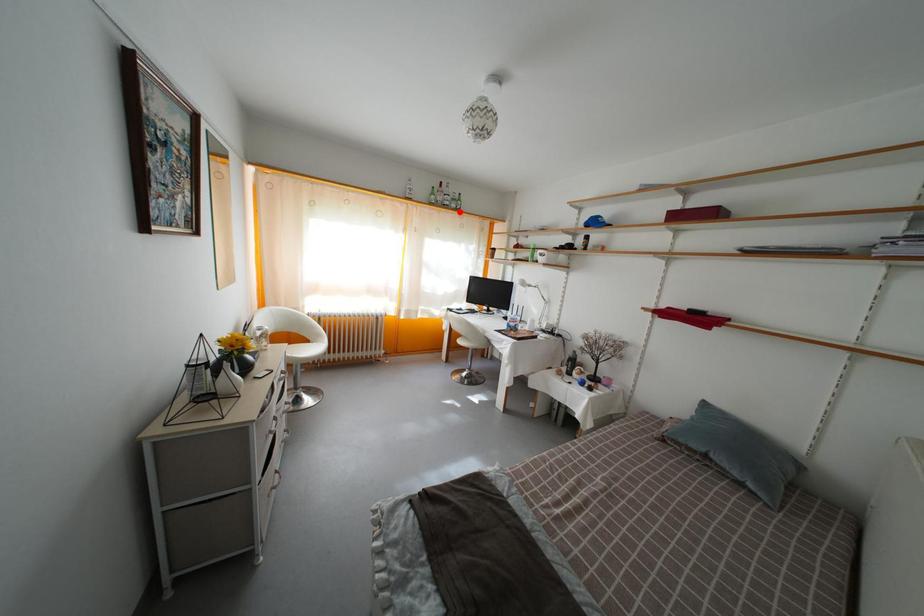
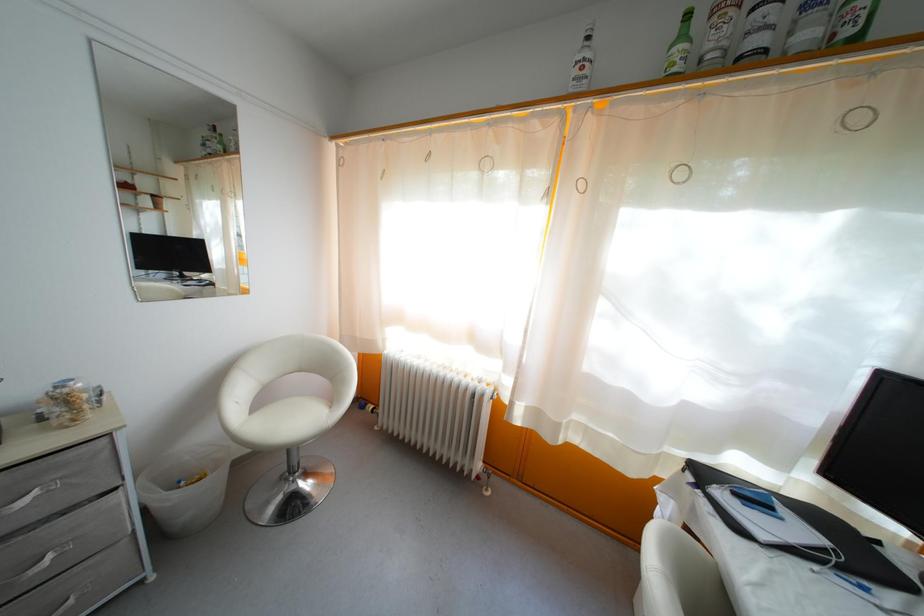
Question: I am providing you with two images of the same scene from different viewpoints. Given a red point in image1, look at the same physical point in image2. Is it:

Choices:
 (A) Closer to the viewpoint
 (B) Farther from the viewpoint

Answer: (B)